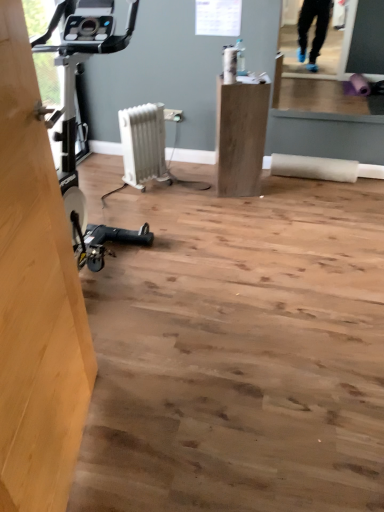
Question: Does matte wood cabinet at center have a lesser width compared to white plastic radiator at center?

Choices:
 (A) no
 (B) yes

Answer: (A)

Question: Is matte wood cabinet at center beside white plastic radiator at center?

Choices:
 (A) yes
 (B) no

Answer: (B)

Question: Does matte wood cabinet at center have a larger size compared to white plastic radiator at center?

Choices:
 (A) yes
 (B) no

Answer: (A)

Question: Could you tell me if matte wood cabinet at center is turned towards white plastic radiator at center?

Choices:
 (A) yes
 (B) no

Answer: (B)

Question: Is matte wood cabinet at center positioned with its back to white plastic radiator at center?

Choices:
 (A) yes
 (B) no

Answer: (B)

Question: From a real-world perspective, relative to light brown wood at left, is matte wood cabinet at center vertically above or below?

Choices:
 (A) above
 (B) below

Answer: (B)

Question: Would you say matte wood cabinet at center is to the left or to the right of light brown wood at left in the picture?

Choices:
 (A) right
 (B) left

Answer: (A)

Question: Does point [x=241, y=96] appear closer or farther from the camera than point [x=64, y=438]?

Choices:
 (A) closer
 (B) farther

Answer: (B)

Question: Considering the positions of matte wood cabinet at center and light brown wood at left in the image, is matte wood cabinet at center wider or thinner than light brown wood at left?

Choices:
 (A) wide
 (B) thin

Answer: (A)

Question: Is point (51, 247) positioned closer to the camera than point (160, 123)?

Choices:
 (A) farther
 (B) closer

Answer: (B)

Question: Looking at the image, does light brown wood at left seem bigger or smaller compared to white plastic radiator at center?

Choices:
 (A) small
 (B) big

Answer: (B)

Question: Considering the positions of light brown wood at left and white plastic radiator at center in the image, is light brown wood at left wider or thinner than white plastic radiator at center?

Choices:
 (A) thin
 (B) wide

Answer: (A)

Question: From the image's perspective, is light brown wood at left positioned above or below white plastic radiator at center?

Choices:
 (A) below
 (B) above

Answer: (A)

Question: Is white plastic radiator at center in front of or behind matte wood cabinet at center in the image?

Choices:
 (A) behind
 (B) front

Answer: (A)

Question: In terms of height, does white plastic radiator at center look taller or shorter compared to matte wood cabinet at center?

Choices:
 (A) short
 (B) tall

Answer: (A)